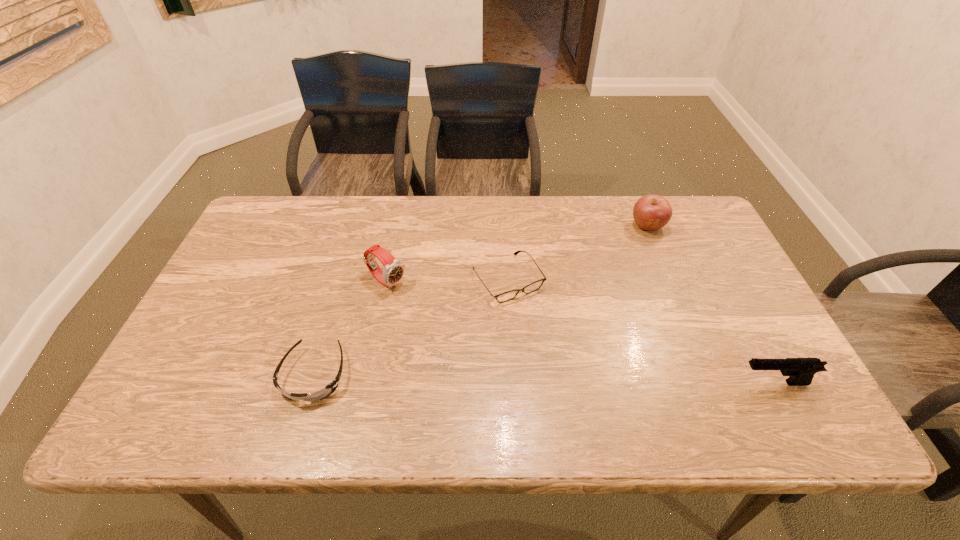
This screenshot has width=960, height=540. In order to click on vacant space on the desktop that is between the sunglasses and the pistol and is positioned on the front-facing side of the third object from right to left in this screenshot , I will do `click(581, 380)`.

Locate an element on the screen. The width and height of the screenshot is (960, 540). vacant spot on the desktop that is between the sunglasses and the pistol and is positioned on the side of the farthest object with the unique marking is located at coordinates (567, 380).

Identify the location of free space on the desktop that is between the sunglasses and the pistol and is positioned on the face of the watch. (529, 379).